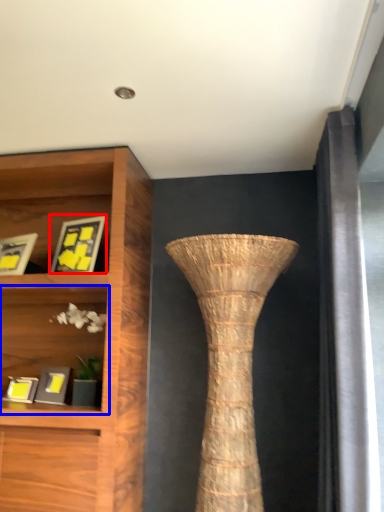
Question: Which of the following is the farthest to the observer, picture frame (highlighted by a red box) or shelf (highlighted by a blue box)?

Choices:
 (A) picture frame
 (B) shelf

Answer: (A)